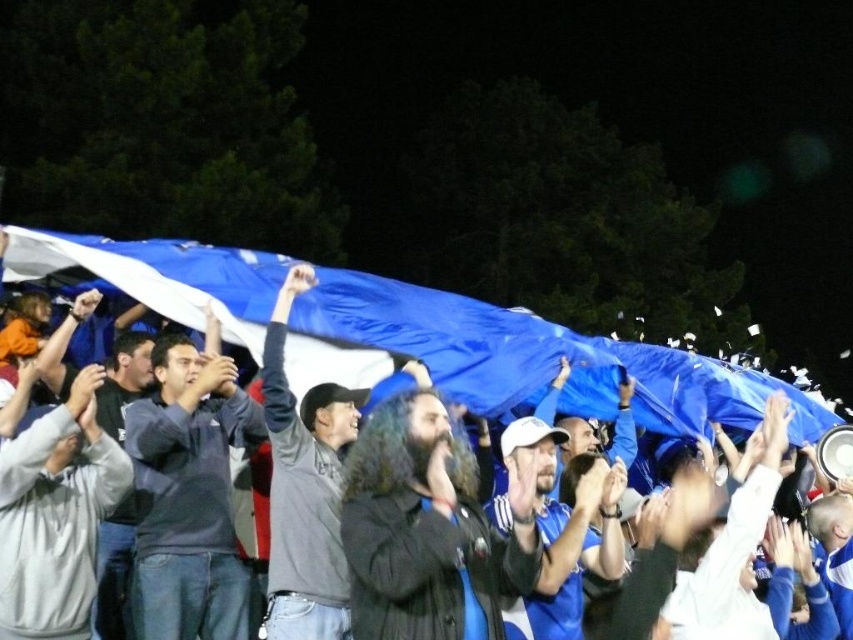
You are a photographer standing at the center of the soccer field during a nighttime match. You want to take a photo of two specific points in the crowd. The first point is at coordinate point (x=495, y=312) and the second is at point (x=102, y=465). Which point will appear closer to the camera in your photo?

Point (x=102, y=465) will appear closer to the camera because according to the description, point (x=495, y=312) is behind point (x=102, y=465).

You are a photographer trying to capture a photo of the crowd at the soccer match. You notice two people wearing gray fleece sweatshirt at center and dark gray sweater at center. Which one is positioned to the left of the other?

The gray fleece sweatshirt at center is positioned to the left of the dark gray sweater at center.